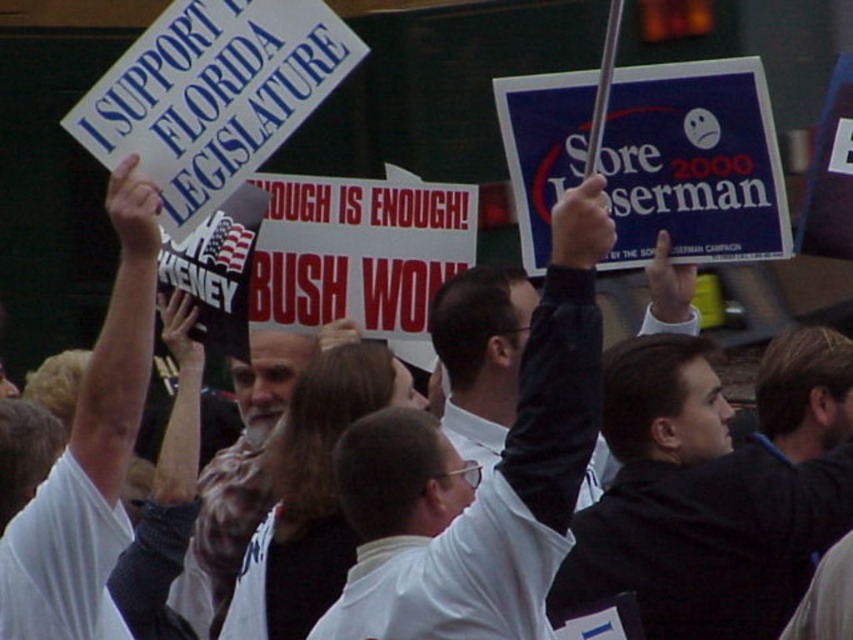
Is white matte shirt at center to the right of black matte jacket at upper right from the viewer's perspective?

In fact, white matte shirt at center is to the left of black matte jacket at upper right.

Is the position of white matte shirt at center less distant than that of black matte jacket at upper right?

That is True.

In order to click on white matte shirt at center in this screenshot , I will do `click(480, 477)`.

The image size is (853, 640). In order to click on white matte shirt at center in this screenshot , I will do [x=480, y=477].

You are a GUI agent. You are given a task and a screenshot of the screen. Output one action in this format:
    pyautogui.click(x=<x>, y=<y>)
    Task: Click on the white matte shirt at center
    The width and height of the screenshot is (853, 640).
    Given the screenshot: What is the action you would take?
    pyautogui.click(x=480, y=477)

Consider the image. Does black matte jacket at upper right appear on the left side of white matte shirt at upper left?

In fact, black matte jacket at upper right is to the right of white matte shirt at upper left.

What do you see at coordinates (698, 506) in the screenshot?
I see `black matte jacket at upper right` at bounding box center [698, 506].

Image resolution: width=853 pixels, height=640 pixels. Identify the location of black matte jacket at upper right. (698, 506).